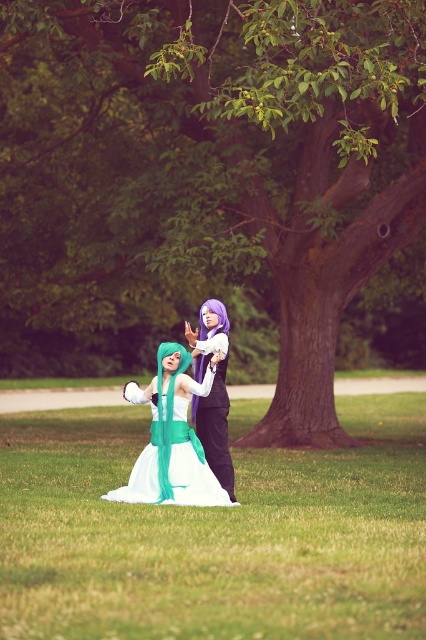
You are a photographer setting up a shoot in the park. You want to ensure the white satin dress at center is visible against the green grass at center. Based on their positions, is the dress likely to stand out visually? Explain why.

The green grass at center is below the white satin dress at center, so the dress will stand out because it is positioned higher and contrasts with the green background.

You are a photographer trying to capture a closeup of the green grass at center while also including the white satin dress at center in the frame. Based on their positions, will you need to adjust your camera focus to ensure both are in focus?

The green grass at center is closer to the viewer than the white satin dress at center. To capture both in focus, you would need to adjust the camera focus to account for the distance difference between the two objects.